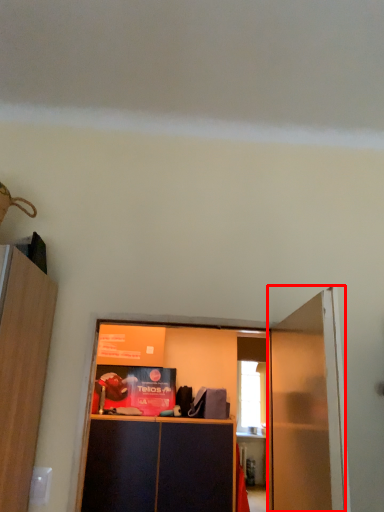
Question: Where is door (annotated by the red box) located in relation to cabinetry in the image?

Choices:
 (A) right
 (B) left

Answer: (A)